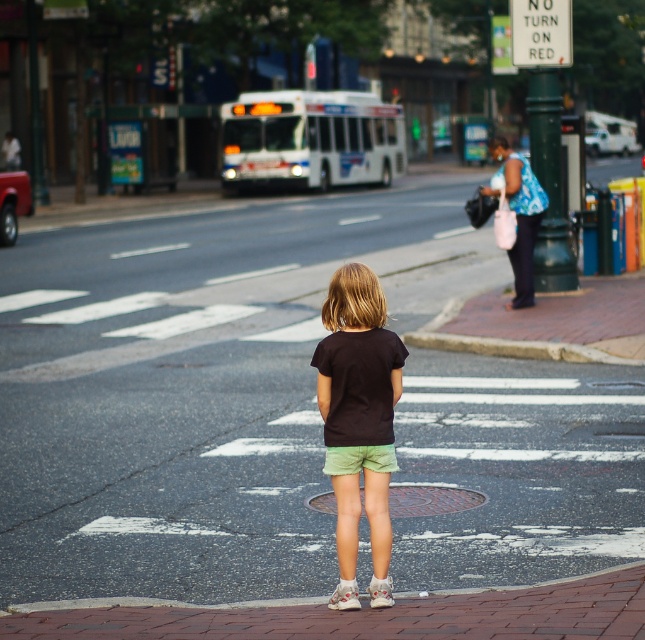
You are a pedestrian standing at the edge of the crosswalk. You need to determine if the smooth asphalt road at center is big enough to accommodate the matte black shirt at center. Can you confirm?

The smooth asphalt road at center is larger in size than the matte black shirt at center, so yes, the smooth asphalt road at center can accommodate the matte black shirt at center.

What are the coordinates of the smooth asphalt road at center?

The coordinates of the smooth asphalt road at center are at point (195, 388).

You are a pedestrian standing at the edge of the crosswalk. You see the smooth asphalt road at center and the matte black shirt at center. Which object is closer to you?

The matte black shirt at center is closer to you because the smooth asphalt road at center is further away.